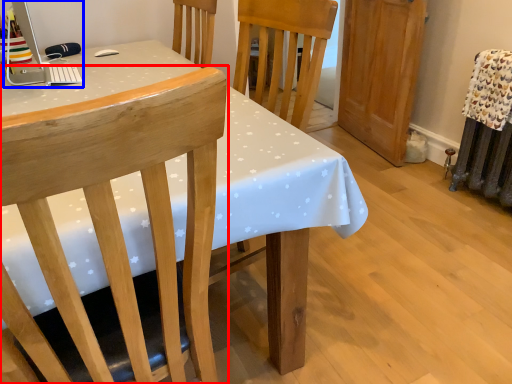
Question: Which point is closer to the camera, chair (highlighted by a red box) or desktop computer (highlighted by a blue box)?

Choices:
 (A) chair
 (B) desktop computer

Answer: (A)